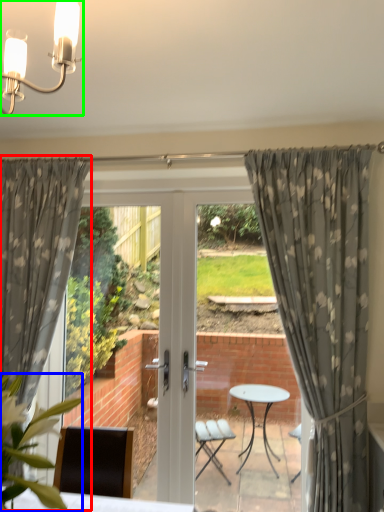
Question: Estimate the real-world distances between objects in this image. Which object is closer to curtain (highlighted by a red box), plant (highlighted by a blue box) or light fixture (highlighted by a green box)?

Choices:
 (A) plant
 (B) light fixture

Answer: (A)